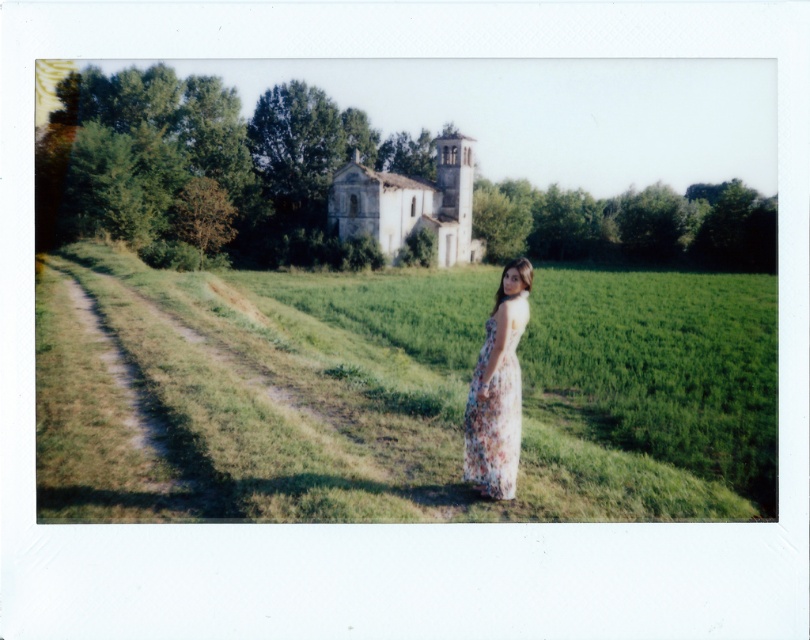
The woman in the image is standing on the green grass at center wearing the floral cotton dress at center. Which of the two is taller?

The green grass at center is much taller than the floral cotton dress at center.